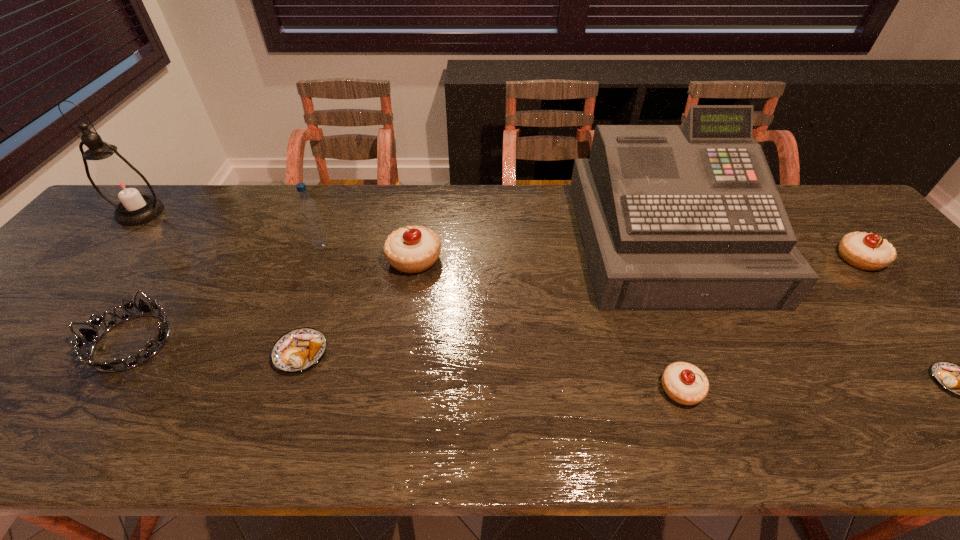
Find the location of a particular element. beige pastry identified as the closest to the second pastry from left to right is located at coordinates (684, 383).

Where is `beige pastry that is the third closest to the smaller brown pastry`? beige pastry that is the third closest to the smaller brown pastry is located at coordinates (412, 249).

Locate an element on the screen. free spot that satisfies the following two spatial constraints: 1. on the front-facing side of the gray cash register; 2. on the front-facing side of the eighth object from right to left is located at coordinates (710, 342).

The height and width of the screenshot is (540, 960). In order to click on free space that satisfies the following two spatial constraints: 1. on the front-facing side of the nearest beige pastry; 2. on the right side of the tiara in this screenshot , I will do `click(100, 389)`.

The image size is (960, 540). In order to click on free point that satisfies the following two spatial constraints: 1. on the front-facing side of the smallest beige pastry; 2. on the right side of the eighth object from right to left in this screenshot , I will do `click(100, 389)`.